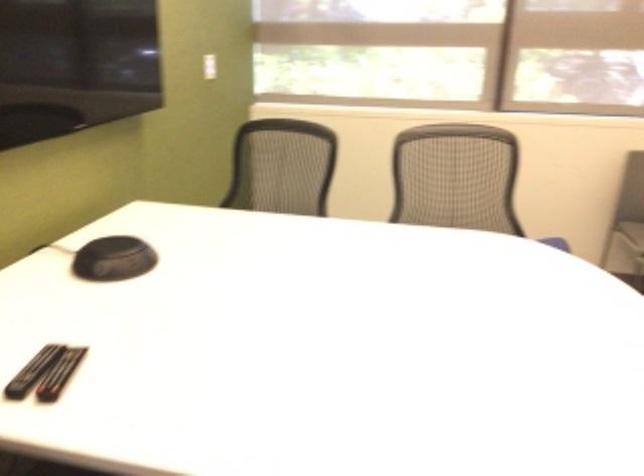
The location [113,259] corresponds to which object?

It refers to a black speakerphone.